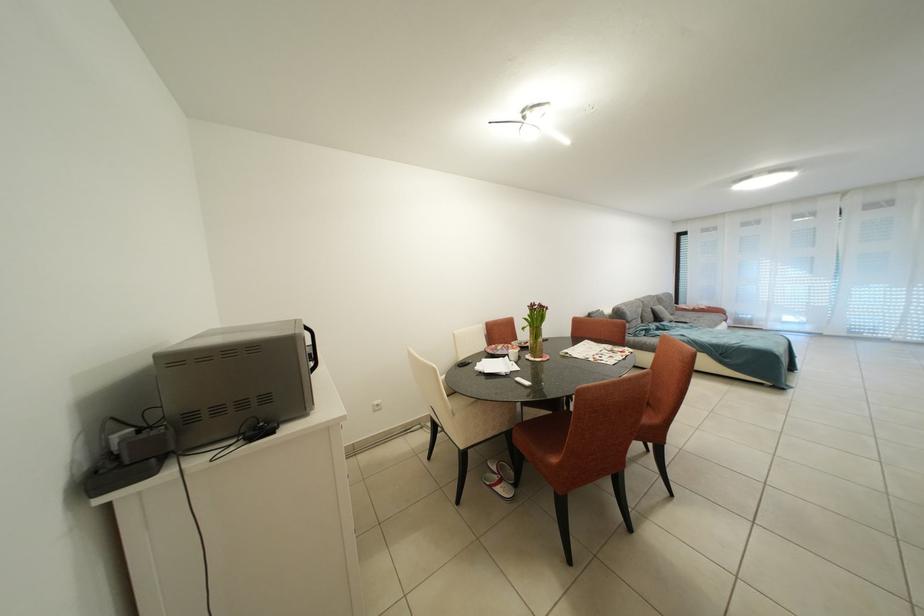
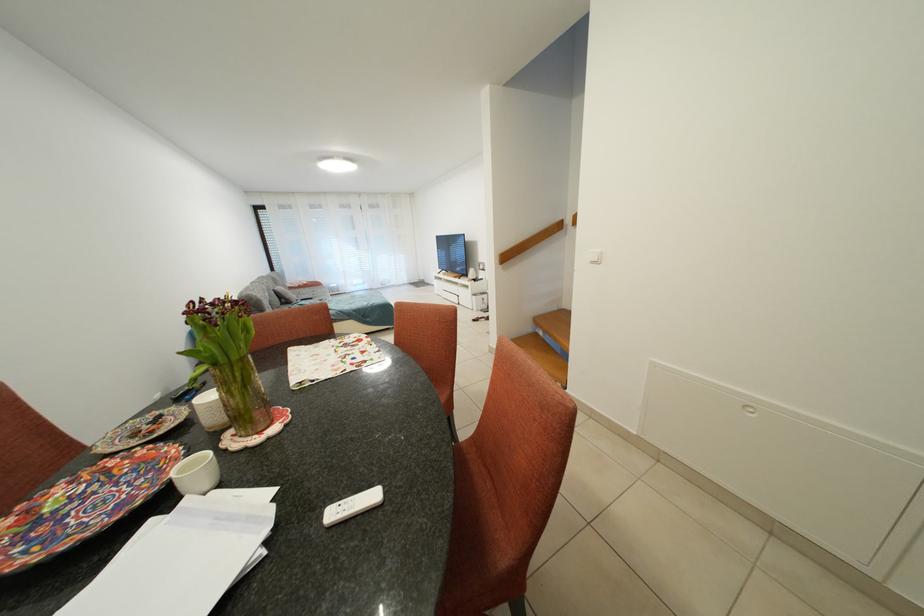
In the second image, find the point that corresponds to point 816,331 in the first image.

(373, 291)